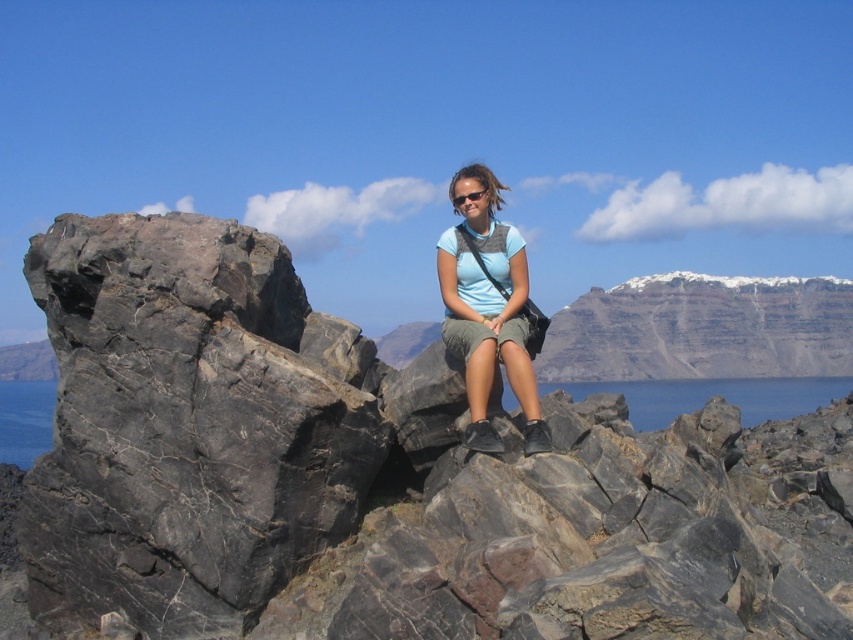
You are standing at the point labeled point (340, 512) and want to walk to the point labeled point (25, 452). Given that the path between them is straight, will you be moving upwards or downwards as you walk towards your destination?

Since point (340, 512) is closer to the viewer than point (25, 452), walking towards the latter would mean moving away from the viewer. In a typical image coordinate system where the origin is at the top left, a lower y coordinate indicates a downward direction. However, since the destination has a lower y value of 0.030 compared to 0.400, this suggests moving downward in the image plane. Therefore, you would be moving downwards as you walk towards point (25, 452).

You are standing at the edge of the volcanic rock area and want to walk to the blue water at center. Is the black rock at left blocking your path?

The black rock at left is in front of blue water at center, so it is blocking the path to the blue water at center.

You are standing at the point with coordinates point (683, 273) and want to walk to the point with coordinates point (746, 378). Which direction should you move to get closer to your destination?

You should move forward because point (683, 273) is behind point (746, 378), so moving forward will bring you closer to the destination.